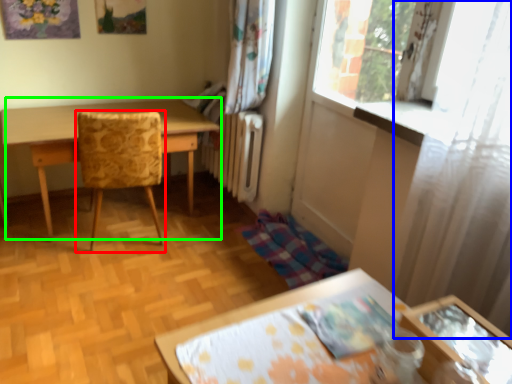
Question: Which object is the farthest from chair (highlighted by a red box)? Choose among these: curtain (highlighted by a blue box) or table (highlighted by a green box).

Choices:
 (A) curtain
 (B) table

Answer: (A)